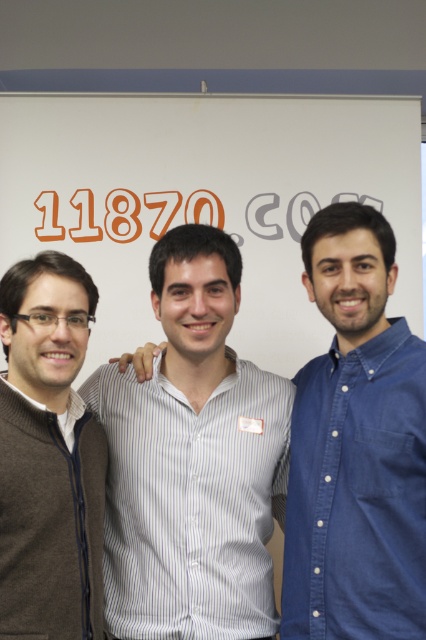
Does point (143, 339) lie behind point (203, 410)?

That is True.

Locate an element on the screen. The width and height of the screenshot is (426, 640). white matte board at center is located at coordinates (207, 198).

Consider the image. Is white striped shirt at center closer to camera compared to brown sweater at left?

No.

Image resolution: width=426 pixels, height=640 pixels. I want to click on white striped shirt at center, so click(x=192, y=460).

The width and height of the screenshot is (426, 640). What are the coordinates of `white striped shirt at center` in the screenshot? It's located at (192, 460).

Between white matte board at center and blue denim shirt at right, which one has less height?

Standing shorter between the two is blue denim shirt at right.

Based on the photo, does white matte board at center appear on the right side of blue denim shirt at right?

No, white matte board at center is not to the right of blue denim shirt at right.

The width and height of the screenshot is (426, 640). I want to click on white matte board at center, so click(207, 198).